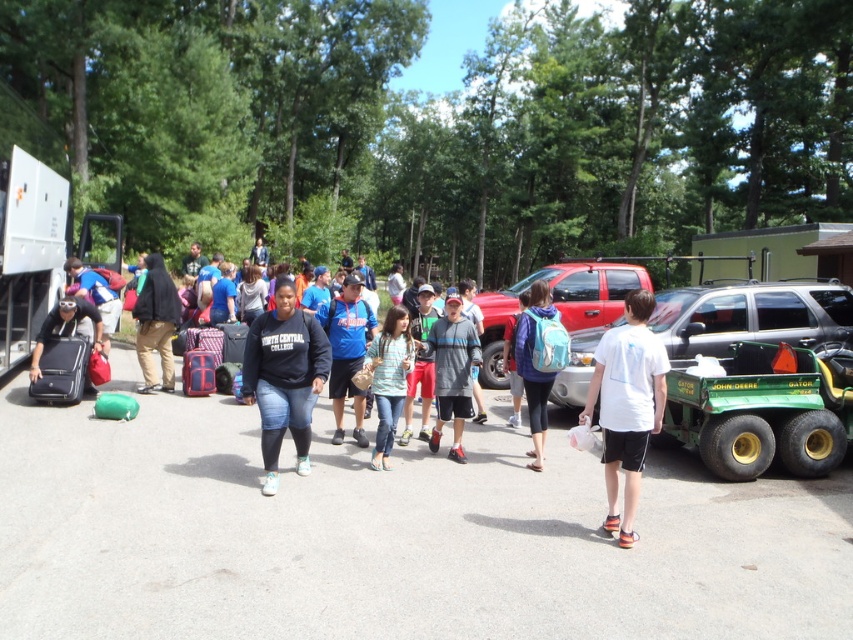
Question: Considering the real-world distances, which object is farthest from the gray asphalt parking lot at center?

Choices:
 (A) blue fleece jacket at center
 (B) gray cotton hoodie at center
 (C) matte black suitcase at left
 (D) metallic red truck at center

Answer: (D)

Question: Based on their relative distances, which object is nearer to the gray asphalt parking lot at center?

Choices:
 (A) blue backpack at center
 (B) green plastic tractor at right
 (C) teal fabric backpack at center

Answer: (C)

Question: Is light blue denim jeans at center in front of matte black suitcase at center?

Choices:
 (A) no
 (B) yes

Answer: (B)

Question: Among these objects, which one is farthest from the camera?

Choices:
 (A) gray asphalt parking lot at center
 (B) gray cotton shirt at center

Answer: (B)

Question: Where is green plastic tractor at right located in relation to khaki pants at center in the image?

Choices:
 (A) below
 (B) above

Answer: (B)

Question: Is green plastic tractor at right wider than white matte shirt at center?

Choices:
 (A) no
 (B) yes

Answer: (B)